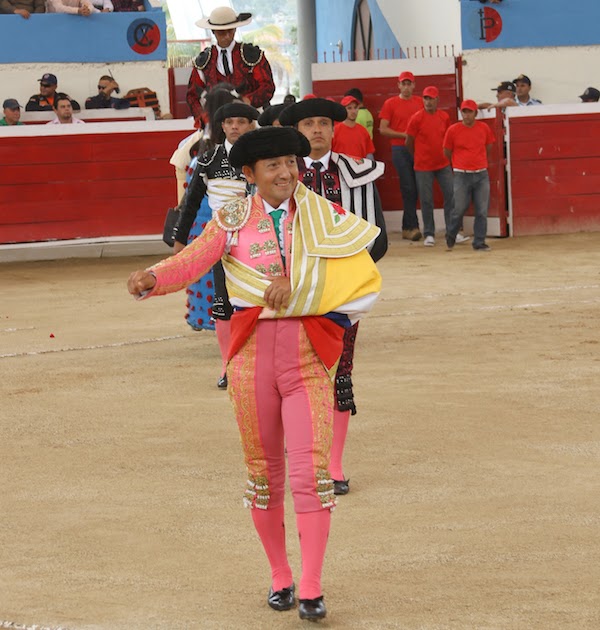
At what (x,y) coordinates should I click in order to perform the action: click on back wall. Please return your answer as a coordinate pair (x, y). Looking at the image, I should click on (575, 24).